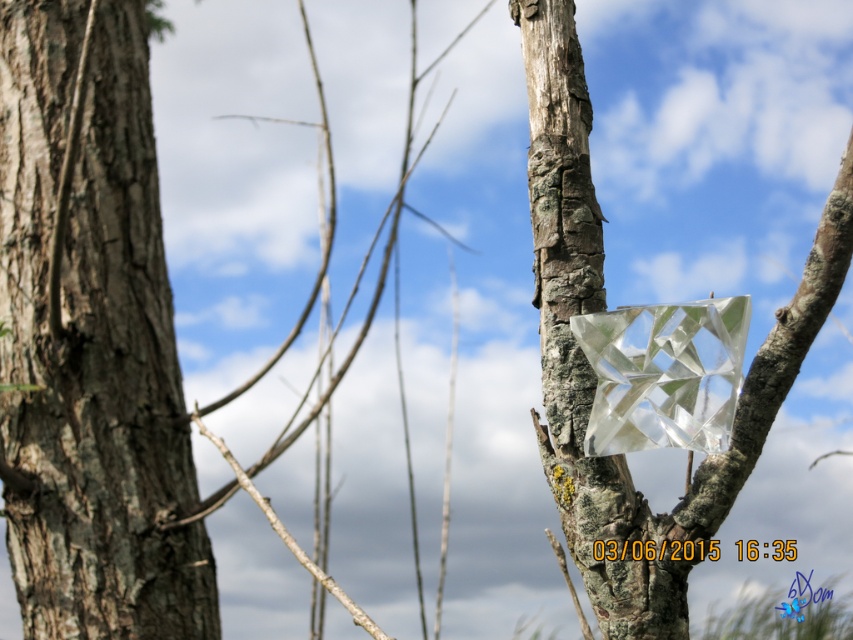
Question: Does rough bark tree trunk at left appear on the right side of transparent glass cube at center?

Choices:
 (A) yes
 (B) no

Answer: (B)

Question: Does rough bark tree trunk at left appear on the right side of transparent glass cube at center?

Choices:
 (A) no
 (B) yes

Answer: (A)

Question: Which point is closer to the camera taking this photo?

Choices:
 (A) (78, 426)
 (B) (630, 540)

Answer: (B)

Question: Which point appears farthest from the camera in this image?

Choices:
 (A) (79, 260)
 (B) (576, 104)

Answer: (A)

Question: Does rough bark tree trunk at left have a larger size compared to transparent glass cube at center?

Choices:
 (A) no
 (B) yes

Answer: (A)

Question: Among these points, which one is farthest from the camera?

Choices:
 (A) (572, 552)
 (B) (157, 440)

Answer: (B)